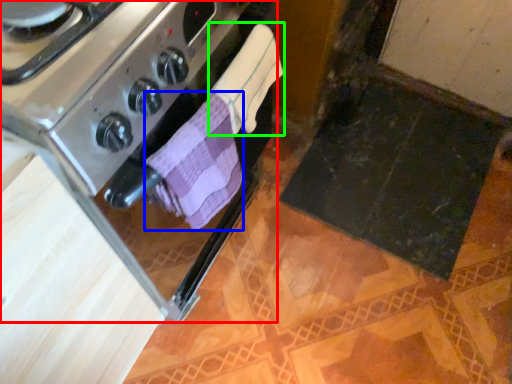
Question: Which is nearer to the kitchen appliance (highlighted by a red box)? bath towel (highlighted by a blue box) or bath towel (highlighted by a green box).

Choices:
 (A) bath towel
 (B) bath towel

Answer: (A)